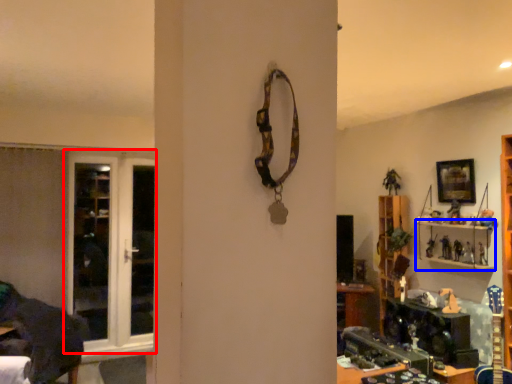
Question: Which of the following is the closest to the observer, door (highlighted by a red box) or shelf (highlighted by a blue box)?

Choices:
 (A) door
 (B) shelf

Answer: (B)